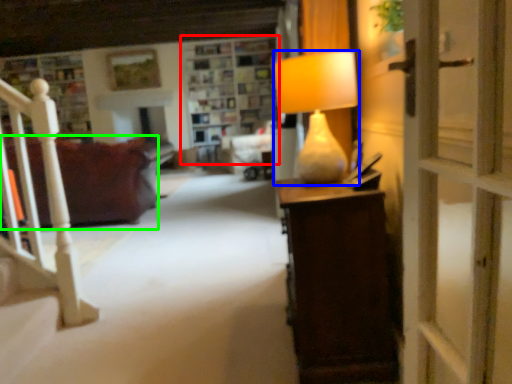
Question: Which object is the closest to the shelf (highlighted by a red box)? Choose among these: lamp (highlighted by a blue box) or studio couch (highlighted by a green box).

Choices:
 (A) lamp
 (B) studio couch

Answer: (B)